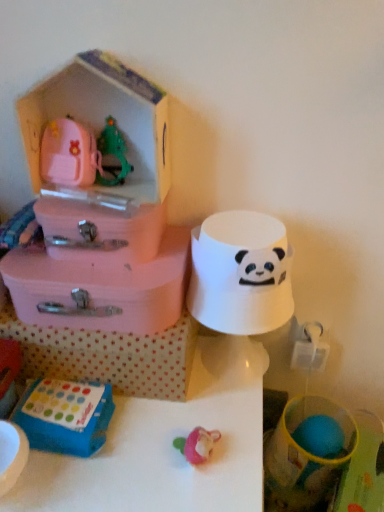
Question: Considering their positions, is white matte table at center located in front of or behind pink plastic suitcase at left, the third storage box in the top-to-bottom sequence?

Choices:
 (A) behind
 (B) front

Answer: (B)

Question: Is white matte table at center to the left or to the right of pink plastic suitcase at left, the third storage box in the top-to-bottom sequence, in the image?

Choices:
 (A) left
 (B) right

Answer: (A)

Question: Estimate the real-world distances between objects in this image. Which object is closer to the pink plastic suitcase at left, the 2th storage box ordered from the bottom?

Choices:
 (A) pink plastic storage box at upper left, which appears as the 1th storage box when ordered from the bottom
 (B) white felt hat at right, marked as the first toy in a right-to-left arrangement
 (C) pink plastic suitcase at upper left, the 3th storage box in the bottom-to-top sequence
 (D) pink plastic toy house at upper left, the fourth storage box when ordered from bottom to top
 (E) blue plastic toy at lower left, positioned as the 2th toy in top-to-bottom order

Answer: (C)

Question: Estimate the real-world distances between objects in this image. Which object is closer to the white felt hat at right, the 1th toy viewed from the top?

Choices:
 (A) pink plastic suitcase at upper left, which is the 2th storage box from top to bottom
 (B) pink plastic toy house at upper left, arranged as the 1th storage box when viewed from the top
 (C) blue plastic toy at lower left, the second toy positioned from the right
 (D) pink plastic storage box at upper left, which appears as the 1th storage box when ordered from the bottom
 (E) pink plastic suitcase at left, the 2th storage box ordered from the bottom

Answer: (E)